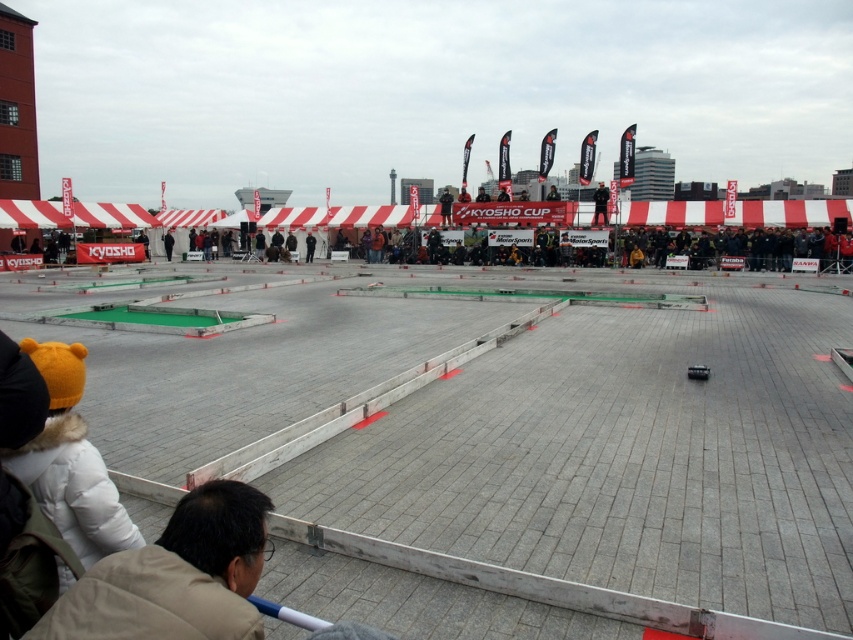
You are standing at the starting line of the model car track and want to reach the finish line. The track has two checkpoints marked as point (x=198, y=600) and point (x=550, y=248). Which checkpoint should you reach first if you follow the shortest path?

You should reach point (x=198, y=600) first because it is closer to the camera, meaning it is nearer to the starting line compared to point (x=550, y=248) which is further away.

You are a photographer at the model car event. You need to capture a photo that includes both the beige fabric jacket at lower left and the dark gray jacket at center. Which jacket should you adjust your camera angle to focus on first to ensure both are in frame?

The beige fabric jacket at lower left is below the dark gray jacket at center. To include both in the frame, focus on the dark gray jacket at center first, then adjust the angle downward to include the beige fabric jacket at lower left.